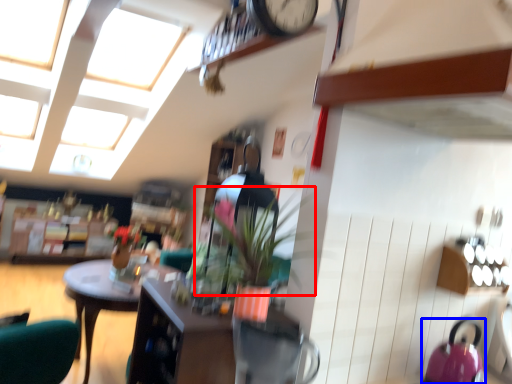
Question: Which object is closer to the camera taking this photo, plant (highlighted by a red box) or kettle (highlighted by a blue box)?

Choices:
 (A) plant
 (B) kettle

Answer: (B)